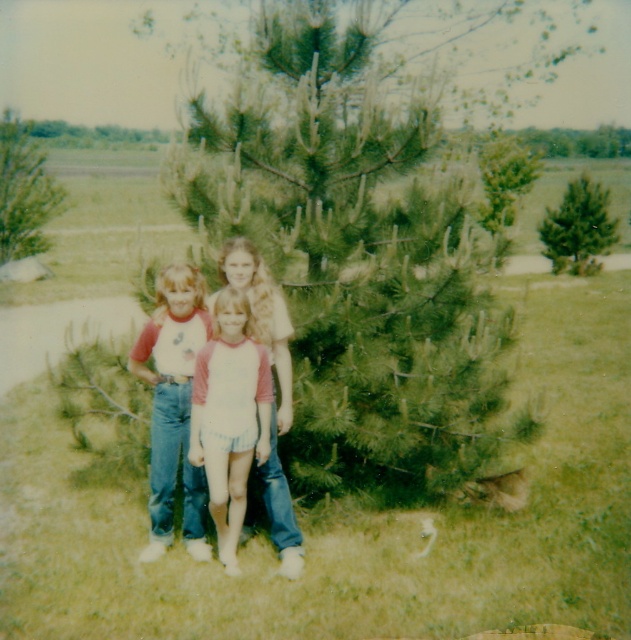
You are a photographer trying to capture a group photo of the children. The camera you are using has a minimum focus distance of 12 inches. Can you focus on both the white cotton shirt at center and the denim jeans at center simultaneously?

The distance between the white cotton shirt at center and the denim jeans at center is 13.38 inches. Since the camera requires a minimum focus distance of 12 inches, the camera can focus on both objects as they are within the required distance.

You are a photographer trying to capture a photo of the green leafy tree at upper left and the green matte pine at upper right. Which tree should you focus on first if you want to start with the one closer to the left side of the image?

The green leafy tree at upper left is to the left of the green matte pine at upper right, so you should focus on the green leafy tree at upper left first since it is closer to the left side of the image.

You are a photographer trying to focus on the white cotton shirt at center. Where should you point your camera to capture it?

You should point your camera at point (230, 417) to capture the white cotton shirt at center.